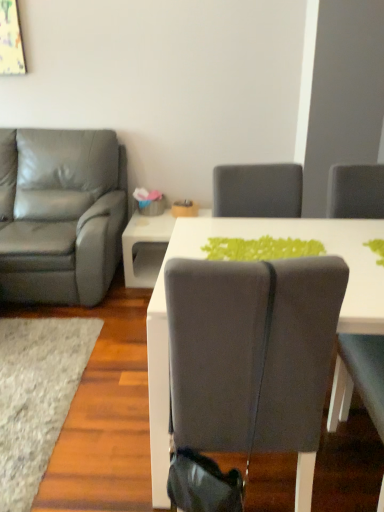
Question: Considering their positions, is matte gray leather armchair at left, positioned as the first chair in back-to-front order, located in front of or behind soft gray carpet at lower left?

Choices:
 (A) behind
 (B) front

Answer: (A)

Question: Would you say matte gray leather armchair at left, which ranks as the second chair in right-to-left order, is inside or outside soft gray carpet at lower left?

Choices:
 (A) outside
 (B) inside

Answer: (A)

Question: Considering the real-world distances, which object is closest to the soft gray carpet at lower left?

Choices:
 (A) matte gray chair at center, the 1th chair from the front
 (B) white glossy table at center
 (C) matte gray leather armchair at left, which ranks as the second chair in right-to-left order

Answer: (C)

Question: Estimate the real-world distances between objects in this image. Which object is closer to the matte gray chair at center, the first chair from the right?

Choices:
 (A) matte gray leather armchair at left, which ranks as the second chair in right-to-left order
 (B) soft gray carpet at lower left
 (C) white glossy table at center

Answer: (B)